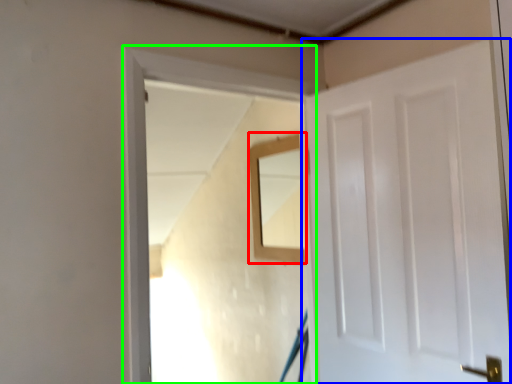
Question: Considering the real-world distances, which object is closest to mirror (highlighted by a red box)? door (highlighted by a blue box) or window frame (highlighted by a green box).

Choices:
 (A) door
 (B) window frame

Answer: (B)